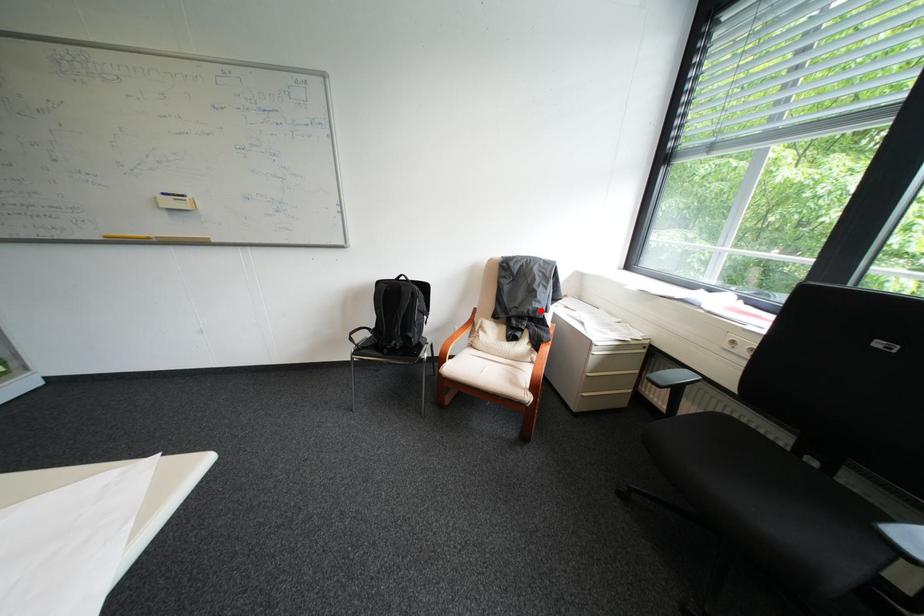
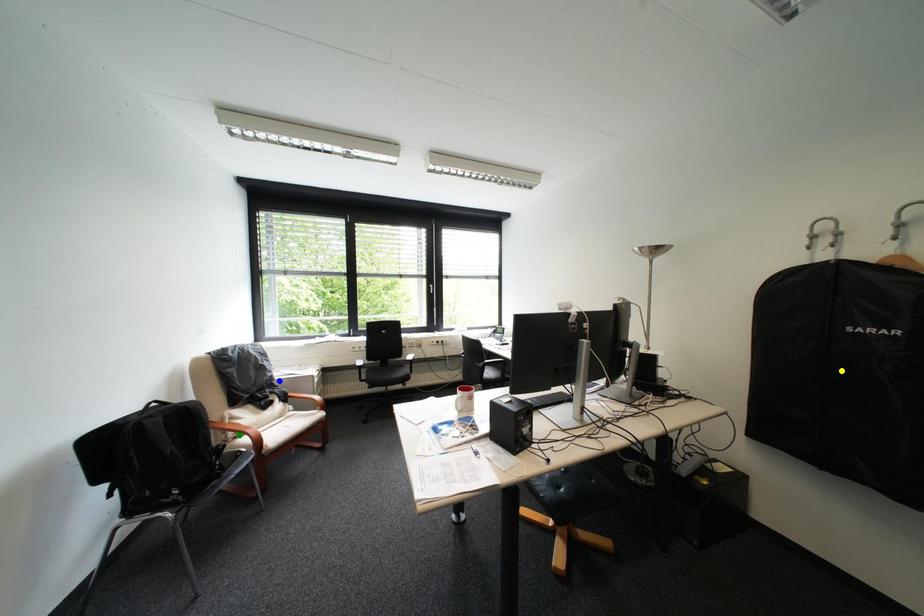
Question: I am providing you with two images of the same scene from different viewpoints. A red point is marked on the first image. You are given multiple points on the second image. In image 2, which mark is for the same physical point as the one in image 1?

Choices:
 (A) yellow point
 (B) green point
 (C) blue point

Answer: (C)